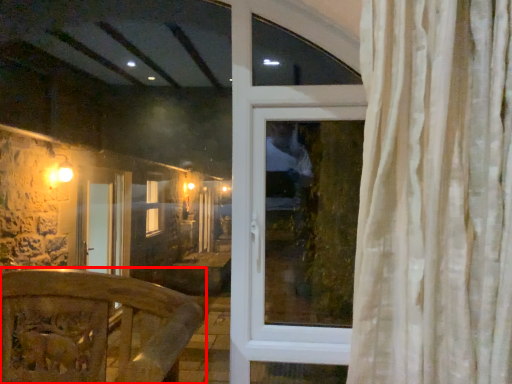
Question: From the image's perspective, considering the relative positions of furniture (annotated by the red box) and window in the image provided, where is furniture (annotated by the red box) located with respect to the staircase?

Choices:
 (A) below
 (B) above

Answer: (A)